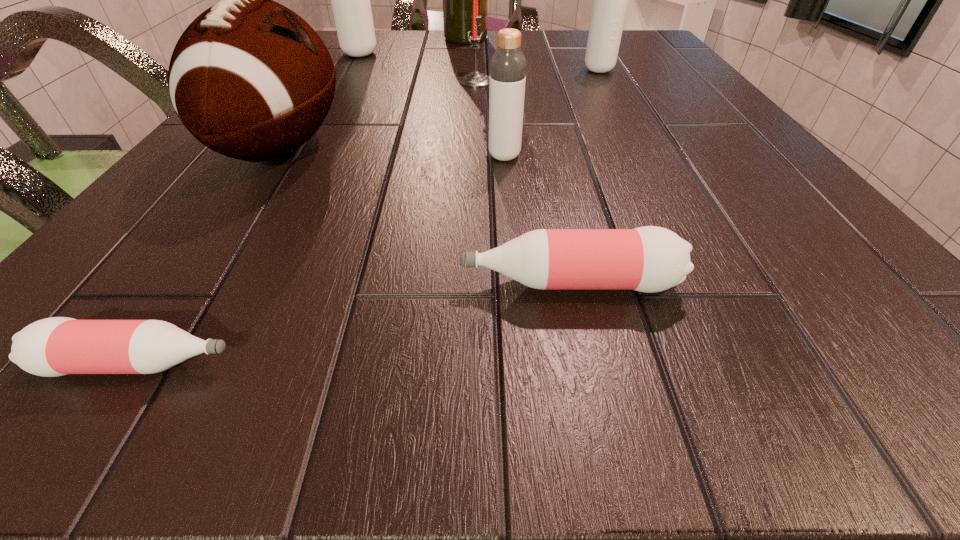
The width and height of the screenshot is (960, 540). In order to click on wine bottle in this screenshot , I will do `click(457, 0)`.

This screenshot has width=960, height=540. I want to click on the farthest object, so click(x=457, y=0).

Identify the location of the farthest gray bottle. The height and width of the screenshot is (540, 960). (350, 0).

I want to click on the farthest bottle, so click(350, 0).

Identify the location of the rightmost bottle. (610, 3).

The height and width of the screenshot is (540, 960). I want to click on the rightmost gray bottle, so click(x=610, y=3).

You are a GUI agent. You are given a task and a screenshot of the screen. Output one action in this format:
    pyautogui.click(x=<x>, y=<y>)
    Task: Click on the football (American)
    Image resolution: width=960 pixels, height=540 pixels.
    Given the screenshot: What is the action you would take?
    pyautogui.click(x=250, y=79)

I want to click on the third shortest bottle, so click(507, 79).

This screenshot has width=960, height=540. In order to click on the nearest gray bottle in this screenshot , I will do `click(507, 79)`.

Find the location of a particular element. red candle is located at coordinates (475, 79).